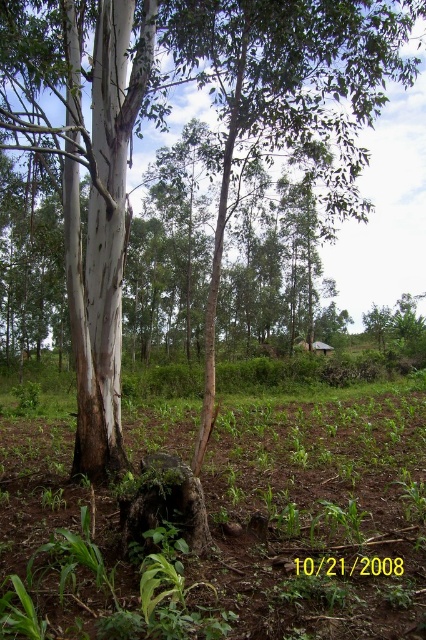
Question: Does brown soil at center have a greater width compared to brown rough stump at center?

Choices:
 (A) no
 (B) yes

Answer: (B)

Question: Does brown soil at center have a greater width compared to brown rough stump at center?

Choices:
 (A) no
 (B) yes

Answer: (B)

Question: Which object appears farthest from the camera in this image?

Choices:
 (A) brown rough stump at center
 (B) brown soil at center

Answer: (A)

Question: Does brown soil at center have a lesser width compared to brown rough stump at center?

Choices:
 (A) yes
 (B) no

Answer: (B)

Question: Which object appears farthest from the camera in this image?

Choices:
 (A) brown soil at center
 (B) brown rough stump at center

Answer: (B)